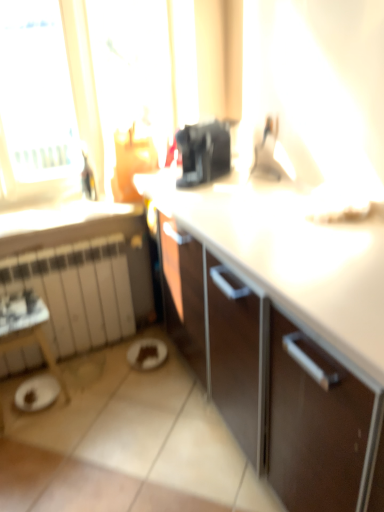
Locate an element on the screen. The image size is (384, 512). free spot behind brown matte plate at lower center is located at coordinates 144,331.